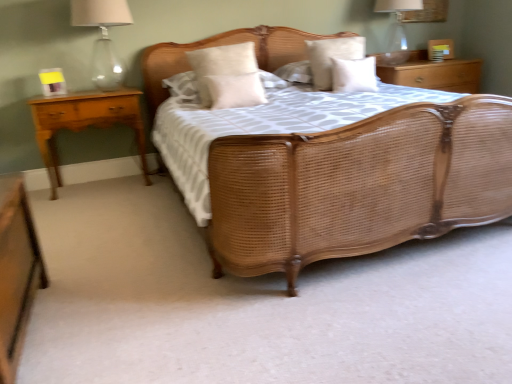
Where is `free spot to the right of wooden nightstand at lower left, marked as the 1th nightstand in a front-to-back arrangement`? free spot to the right of wooden nightstand at lower left, marked as the 1th nightstand in a front-to-back arrangement is located at coordinates (142, 324).